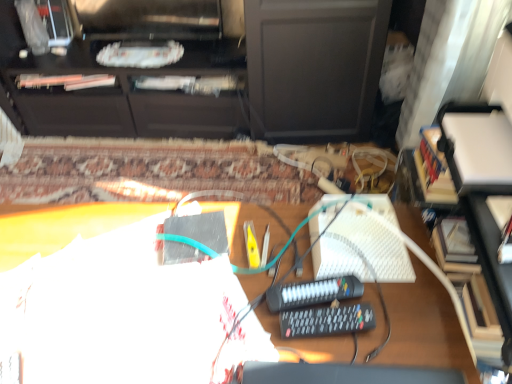
At what (x,y) coordinates should I click in order to perform the action: click on free spot to the right of black plastic remote control at center, marked as the 1th equipment in a front-to-back arrangement. Please return your answer as a coordinate pair (x, y). This screenshot has height=384, width=512. Looking at the image, I should click on (407, 322).